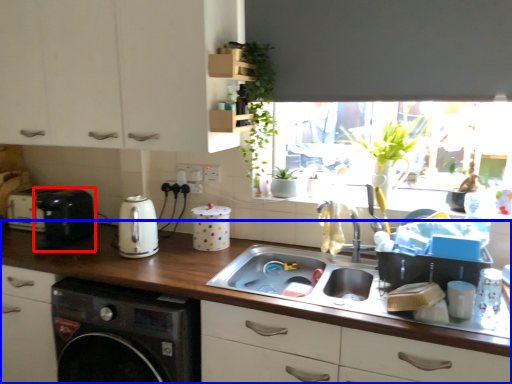
Question: Among these objects, which one is farthest to the camera, appliance (highlighted by a red box) or countertop (highlighted by a blue box)?

Choices:
 (A) appliance
 (B) countertop

Answer: (A)